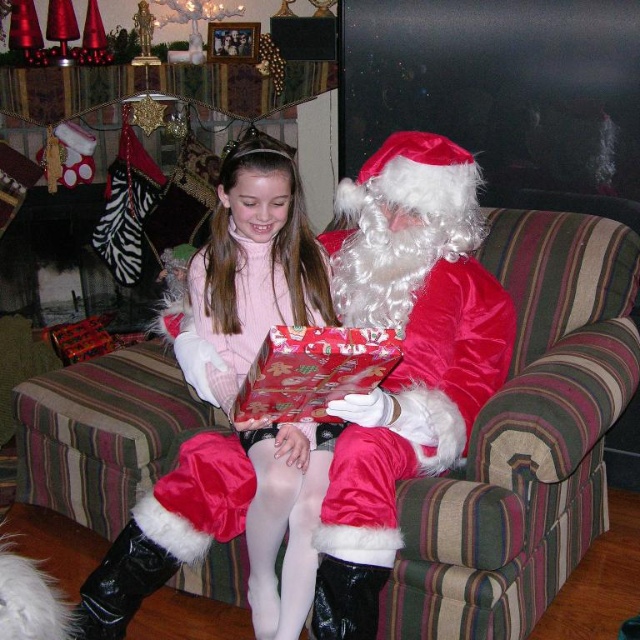
Question: Which object is closer to the camera taking this photo?

Choices:
 (A) matte pink sweater at center
 (B) satin santa at center
 (C) shiny red wrapping paper at center

Answer: (B)

Question: Does satin santa at center lie behind shiny red wrapping paper at center?

Choices:
 (A) no
 (B) yes

Answer: (A)

Question: Is satin santa at center positioned behind matte pink sweater at center?

Choices:
 (A) no
 (B) yes

Answer: (A)

Question: Which point is closer to the camera?

Choices:
 (A) (296, 595)
 (B) (282, 396)
 (C) (552, 484)

Answer: (B)

Question: Which of the following is the closest to the observer?

Choices:
 (A) (435, 321)
 (B) (276, 403)
 (C) (476, 532)
 (D) (234, 241)

Answer: (C)

Question: Considering the relative positions of striped fabric couch at center and matte pink sweater at center in the image provided, where is striped fabric couch at center located with respect to matte pink sweater at center?

Choices:
 (A) below
 (B) above

Answer: (A)